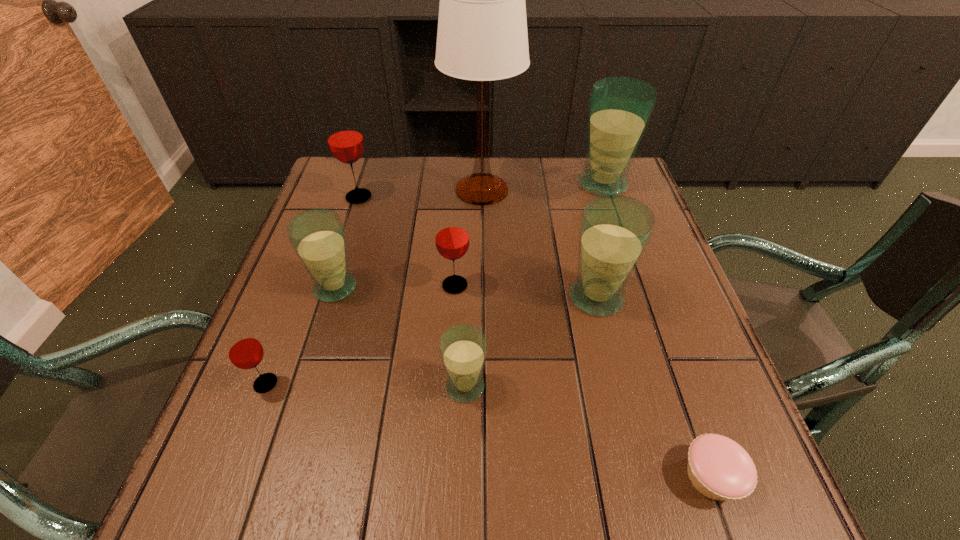
At what (x,y) coordinates should I click in order to perform the action: click on vacant area that lies between the smallest red glass and the biggest blue glass. Please return your answer as a coordinate pair (x, y). Looking at the image, I should click on (435, 284).

Locate an element on the screen. vacant space in between the second smallest red glass and the leftmost blue glass is located at coordinates (396, 287).

The height and width of the screenshot is (540, 960). I want to click on vacant space that is in between the farthest blue glass and the rightmost red glass, so click(x=529, y=234).

Where is `unoccupied position between the nearest blue glass and the eighth shortest object`? The height and width of the screenshot is (540, 960). unoccupied position between the nearest blue glass and the eighth shortest object is located at coordinates (534, 285).

What are the coordinates of `blank region between the smallest red glass and the nearest blue glass` in the screenshot? It's located at (366, 385).

Identify the location of free space that is in between the rightmost red glass and the smallest red glass. (360, 334).

Locate an element on the screen. The width and height of the screenshot is (960, 540). object that ranks as the closest to the pink cupcake is located at coordinates (614, 231).

Where is `the eighth closest object relative to the smallest red glass`? The width and height of the screenshot is (960, 540). the eighth closest object relative to the smallest red glass is located at coordinates (620, 108).

Select which glass appears as the second closest to the tallest glass. Please provide its 2D coordinates. Your answer should be formatted as a tuple, i.e. [(x, y)], where the tuple contains the x and y coordinates of a point satisfying the conditions above.

[(452, 240)]

At what (x,y) coordinates should I click in order to perform the action: click on the second closest glass relative to the table lamp. Please return your answer as a coordinate pair (x, y). This screenshot has height=540, width=960. Looking at the image, I should click on (345, 140).